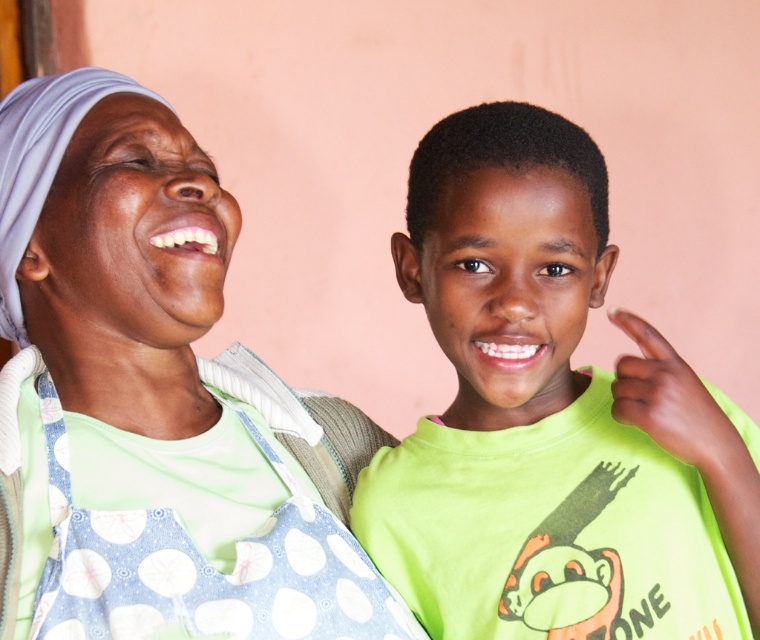
You are a photographer trying to capture a closeup shot of the polka dot apron at left and the blue polka dot fabric apron at center. Which apron should you focus on first to ensure it appears clearer in the photo?

You should focus on the polka dot apron at left first because it is closer to the viewer, making it easier to capture a clear closeup compared to the blue polka dot fabric apron at center which is further away.

You are helping organize a clothing store and need to decide where to place the polka dot apron at left and the blue polka dot fabric apron at center. Since the store has limited space, which apron should be placed on the narrower shelf to save space?

The blue polka dot fabric apron at center should be placed on the narrower shelf because its width is smaller than the polka dot apron at left.

You are a photographer standing in front of the scene. You want to take a closeup photo of the polka dot apron at left. The camera you are using has a minimum focusing distance of 50 centimeters. Can you take the photo without moving the camera or the apron?

The distance between the polka dot apron at left and the camera is 80.69 centimeters, which is greater than the minimum focusing distance of 50 centimeters. Therefore, you can take the closeup photo without moving the camera or the apron.